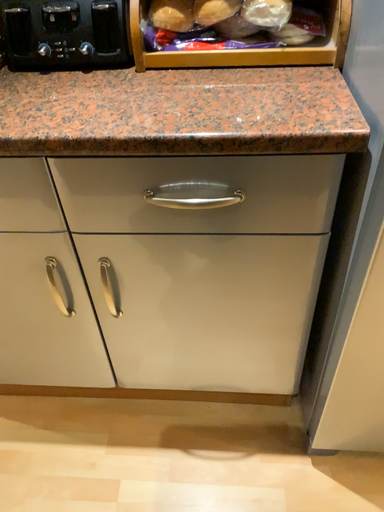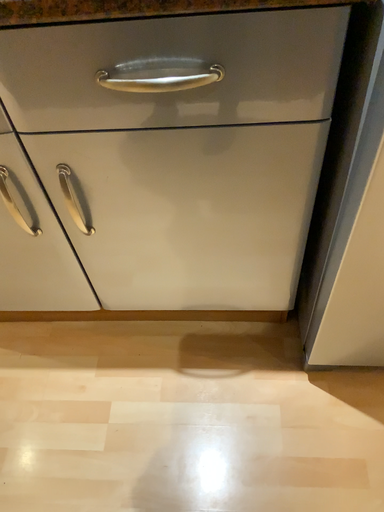
Question: How did the camera likely rotate when shooting the video?

Choices:
 (A) rotated upward
 (B) rotated downward

Answer: (B)